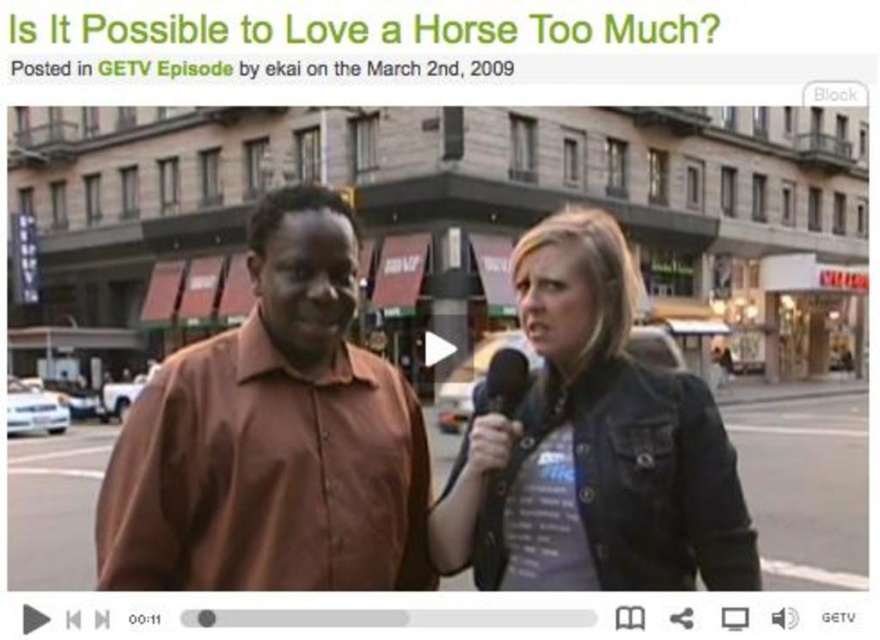
Question: Which point appears closest to the camera in this image?

Choices:
 (A) (515, 371)
 (B) (678, 436)

Answer: (B)

Question: Which point is closer to the camera?

Choices:
 (A) (517, 406)
 (B) (590, 435)
 (C) (371, 412)

Answer: (B)

Question: Is denim jacket at center above black matte microphone at center?

Choices:
 (A) yes
 (B) no

Answer: (A)

Question: Among these points, which one is nearest to the camera?

Choices:
 (A) (308, 529)
 (B) (504, 349)

Answer: (A)

Question: Does denim jacket at center appear under black matte microphone at center?

Choices:
 (A) no
 (B) yes

Answer: (A)

Question: Is brown shirt at center bigger than black matte microphone at center?

Choices:
 (A) yes
 (B) no

Answer: (B)